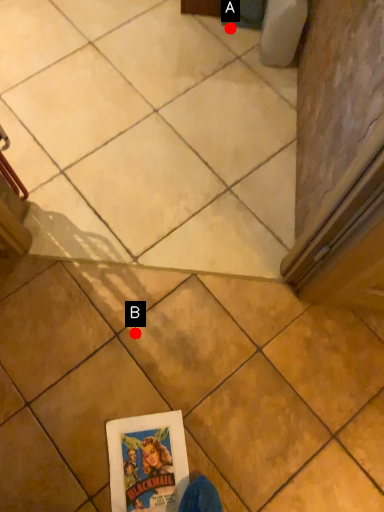
Question: Two points are circled on the image, labeled by A and B beside each circle. Among these points, which one is farthest from the camera?

Choices:
 (A) A is further
 (B) B is further

Answer: (A)